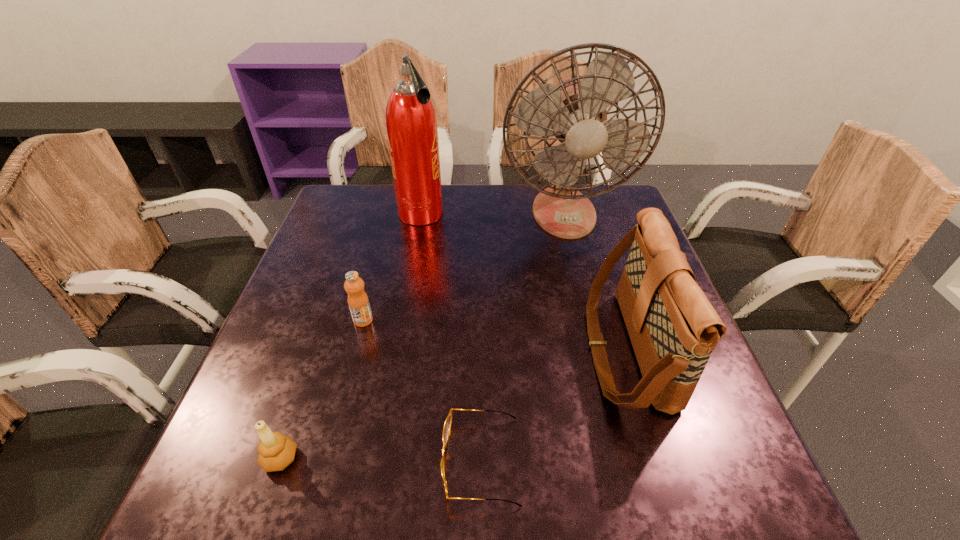
The height and width of the screenshot is (540, 960). In order to click on unoccupied position between the spectacles and the shoulder bag in this screenshot , I will do `click(553, 404)`.

Identify which object is the fourth closest to the fan. Please provide its 2D coordinates. Your answer should be formatted as a tuple, i.e. [(x, y)], where the tuple contains the x and y coordinates of a point satisfying the conditions above.

[(448, 422)]

Identify which object is the fifth nearest to the second shortest object. Please provide its 2D coordinates. Your answer should be formatted as a tuple, i.e. [(x, y)], where the tuple contains the x and y coordinates of a point satisfying the conditions above.

[(574, 111)]